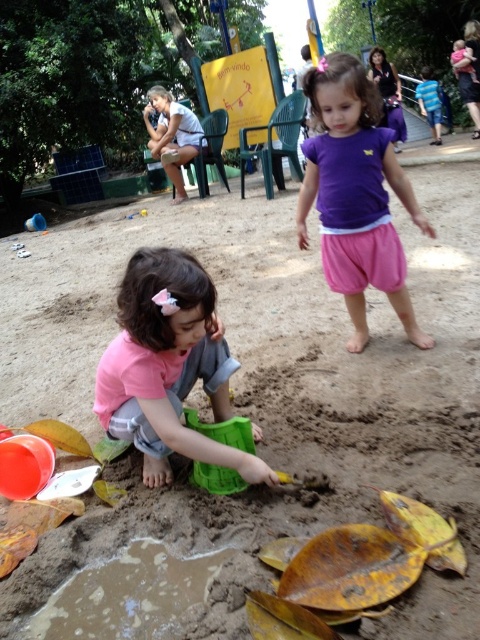
Question: Can you confirm if pink matte shirt at lower left is positioned below purple cotton shirt at center?

Choices:
 (A) yes
 (B) no

Answer: (A)

Question: Which point is closer to the camera?

Choices:
 (A) (350, 177)
 (B) (152, 305)

Answer: (B)

Question: Where is pink matte shirt at lower left located in relation to purple cotton shirt at center in the image?

Choices:
 (A) right
 (B) left

Answer: (B)

Question: Is pink matte shirt at lower left thinner than purple cotton shirt at center?

Choices:
 (A) no
 (B) yes

Answer: (A)

Question: Which point is closer to the camera?

Choices:
 (A) purple cotton shirt at center
 (B) pink matte shirt at lower left

Answer: (B)